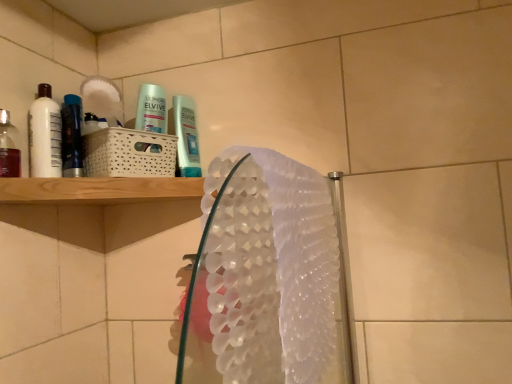
The image size is (512, 384). I want to click on metallic blue mouthwash at left, acting as the third mouthwash starting from the front, so click(x=72, y=136).

What do you see at coordinates (45, 135) in the screenshot? The width and height of the screenshot is (512, 384). I see `white glossy mouthwash at left, the second mouthwash from the front` at bounding box center [45, 135].

Where is `white glossy mouthwash at left, the second mouthwash from the back`? white glossy mouthwash at left, the second mouthwash from the back is located at coordinates (45, 135).

From the picture: Measure the distance between translucent plastic mouthwash at left, which is counted as the 1th mouthwash, starting from the front, and camera.

They are 34.76 inches apart.

You are a GUI agent. You are given a task and a screenshot of the screen. Output one action in this format:
    pyautogui.click(x=<x>, y=<y>)
    Task: Click on the translucent plastic mouthwash at left, which is counted as the 1th mouthwash, starting from the front
    
    Given the screenshot: What is the action you would take?
    pyautogui.click(x=9, y=147)

Measure the distance between white textured hand towel at center and camera.

They are 17.28 inches apart.

Find the location of a particular element. white textured hand towel at center is located at coordinates (263, 274).

The width and height of the screenshot is (512, 384). In order to click on metallic blue mouthwash at left, which is the first mouthwash from back to front in this screenshot , I will do `click(72, 136)`.

Which is nearer, (16, 175) or (63, 148)?

Point (16, 175)

From the image's perspective, is translucent plastic mouthwash at left, which appears as the third mouthwash when viewed from the back, located above metallic blue mouthwash at left, acting as the third mouthwash starting from the front?

No, from the image's perspective, translucent plastic mouthwash at left, which appears as the third mouthwash when viewed from the back, is not above metallic blue mouthwash at left, acting as the third mouthwash starting from the front.

How distant is translucent plastic mouthwash at left, which is counted as the 1th mouthwash, starting from the front, from metallic blue mouthwash at left, which is the first mouthwash from back to front?

translucent plastic mouthwash at left, which is counted as the 1th mouthwash, starting from the front, and metallic blue mouthwash at left, which is the first mouthwash from back to front, are 11.46 centimeters apart from each other.

Is white glossy mouthwash at left, the second mouthwash from the front, at the right side of metallic blue mouthwash at left, acting as the third mouthwash starting from the front?

Incorrect, white glossy mouthwash at left, the second mouthwash from the front, is not on the right side of metallic blue mouthwash at left, acting as the third mouthwash starting from the front.

Could you tell me if white glossy mouthwash at left, the second mouthwash from the front, is turned towards metallic blue mouthwash at left, acting as the third mouthwash starting from the front?

No, white glossy mouthwash at left, the second mouthwash from the front, is not facing towards metallic blue mouthwash at left, acting as the third mouthwash starting from the front.

Is there a large distance between white glossy mouthwash at left, the second mouthwash from the back, and metallic blue mouthwash at left, which is the first mouthwash from back to front?

No, white glossy mouthwash at left, the second mouthwash from the back, is not far from metallic blue mouthwash at left, which is the first mouthwash from back to front.

Is the position of white glossy mouthwash at left, the second mouthwash from the back, less distant than that of metallic blue mouthwash at left, acting as the third mouthwash starting from the front?

Yes, the depth of white glossy mouthwash at left, the second mouthwash from the back, is less than that of metallic blue mouthwash at left, acting as the third mouthwash starting from the front.

From a real-world perspective, count 2nd mouthwashs upward from the translucent plastic mouthwash at left, which is counted as the 1th mouthwash, starting from the front, and point to it. Please provide its 2D coordinates.

[(45, 135)]

Considering the positions of points (13, 127) and (37, 112), is point (13, 127) farther from camera compared to point (37, 112)?

Yes, it is.

Is translucent plastic mouthwash at left, which appears as the third mouthwash when viewed from the back, to the left or to the right of white glossy mouthwash at left, the second mouthwash from the back, in the image?

Clearly, translucent plastic mouthwash at left, which appears as the third mouthwash when viewed from the back, is on the left of white glossy mouthwash at left, the second mouthwash from the back, in the image.

From the image's perspective, between translucent plastic mouthwash at left, which appears as the third mouthwash when viewed from the back, and white glossy mouthwash at left, the second mouthwash from the back, who is located below?

From the image's view, translucent plastic mouthwash at left, which appears as the third mouthwash when viewed from the back, is below.

Is translucent plastic mouthwash at left, which appears as the third mouthwash when viewed from the back, behind white textured hand towel at center?

Yes, translucent plastic mouthwash at left, which appears as the third mouthwash when viewed from the back, is behind white textured hand towel at center.

Is translucent plastic mouthwash at left, which appears as the third mouthwash when viewed from the back, turned away from white textured hand towel at center?

No, translucent plastic mouthwash at left, which appears as the third mouthwash when viewed from the back, is not facing the opposite direction of white textured hand towel at center.

From the image's perspective, would you say translucent plastic mouthwash at left, which is counted as the 1th mouthwash, starting from the front, is shown under white textured hand towel at center?

No, from the image's perspective, translucent plastic mouthwash at left, which is counted as the 1th mouthwash, starting from the front, is not beneath white textured hand towel at center.

Can you confirm if metallic blue mouthwash at left, acting as the third mouthwash starting from the front, is thinner than white textured hand towel at center?

Correct, the width of metallic blue mouthwash at left, acting as the third mouthwash starting from the front, is less than that of white textured hand towel at center.

From the image's perspective, between metallic blue mouthwash at left, which is the first mouthwash from back to front, and white textured hand towel at center, which one is located above?

metallic blue mouthwash at left, which is the first mouthwash from back to front, from the image's perspective.

From a real-world perspective, between metallic blue mouthwash at left, which is the first mouthwash from back to front, and white textured hand towel at center, who is vertically higher?

metallic blue mouthwash at left, which is the first mouthwash from back to front.

Which of these two, metallic blue mouthwash at left, which is the first mouthwash from back to front, or white textured hand towel at center, stands taller?

white textured hand towel at center is taller.

Do you think white textured hand towel at center is within translucent plastic mouthwash at left, which is counted as the 1th mouthwash, starting from the front, or outside of it?

white textured hand towel at center exists outside the volume of translucent plastic mouthwash at left, which is counted as the 1th mouthwash, starting from the front.

Considering their positions, is white textured hand towel at center located in front of or behind translucent plastic mouthwash at left, which appears as the third mouthwash when viewed from the back?

Visually, white textured hand towel at center is located in front of translucent plastic mouthwash at left, which appears as the third mouthwash when viewed from the back.

Can you confirm if white textured hand towel at center is taller than translucent plastic mouthwash at left, which appears as the third mouthwash when viewed from the back?

Yes.

Can you confirm if white textured hand towel at center is wider than translucent plastic mouthwash at left, which appears as the third mouthwash when viewed from the back?

Indeed, white textured hand towel at center has a greater width compared to translucent plastic mouthwash at left, which appears as the third mouthwash when viewed from the back.

From the image's perspective, relative to white textured hand towel at center, is white glossy mouthwash at left, the second mouthwash from the front, above or below?

From the image's perspective, white glossy mouthwash at left, the second mouthwash from the front, appears above white textured hand towel at center.

Relative to white textured hand towel at center, is white glossy mouthwash at left, the second mouthwash from the back, in front or behind?

Visually, white glossy mouthwash at left, the second mouthwash from the back, is located behind white textured hand towel at center.

Considering the relative sizes of white glossy mouthwash at left, the second mouthwash from the front, and white textured hand towel at center in the image provided, is white glossy mouthwash at left, the second mouthwash from the front, thinner than white textured hand towel at center?

Yes, white glossy mouthwash at left, the second mouthwash from the front, is thinner than white textured hand towel at center.

Is white glossy mouthwash at left, the second mouthwash from the back, turned away from white textured hand towel at center?

white glossy mouthwash at left, the second mouthwash from the back, is not turned away from white textured hand towel at center.

Find the location of `the 1st mouthwash directly above the translucent plastic mouthwash at left, which appears as the third mouthwash when viewed from the back (from a real-world perspective)`. the 1st mouthwash directly above the translucent plastic mouthwash at left, which appears as the third mouthwash when viewed from the back (from a real-world perspective) is located at coordinates 72,136.

In the image, there is a white glossy mouthwash at left, the second mouthwash from the front. Find the location of `mouthwash above it (from the image's perspective)`. mouthwash above it (from the image's perspective) is located at coordinates (72, 136).

Which object lies nearer to the anchor point metallic blue mouthwash at left, which is the first mouthwash from back to front, white glossy mouthwash at left, the second mouthwash from the back, or translucent plastic mouthwash at left, which is counted as the 1th mouthwash, starting from the front?

white glossy mouthwash at left, the second mouthwash from the back, lies closer to metallic blue mouthwash at left, which is the first mouthwash from back to front, than the other object.

From the image, which object appears to be nearer to translucent plastic mouthwash at left, which is counted as the 1th mouthwash, starting from the front, metallic blue mouthwash at left, which is the first mouthwash from back to front, or white textured hand towel at center?

metallic blue mouthwash at left, which is the first mouthwash from back to front.

Which object lies nearer to the anchor point metallic blue mouthwash at left, which is the first mouthwash from back to front, white textured hand towel at center or translucent plastic mouthwash at left, which is counted as the 1th mouthwash, starting from the front?

translucent plastic mouthwash at left, which is counted as the 1th mouthwash, starting from the front.

When comparing their distances from white glossy mouthwash at left, the second mouthwash from the front, does translucent plastic mouthwash at left, which appears as the third mouthwash when viewed from the back, or white textured hand towel at center seem further?

Among the two, white textured hand towel at center is located further to white glossy mouthwash at left, the second mouthwash from the front.

Based on the photo, based on their spatial positions, is white textured hand towel at center or metallic blue mouthwash at left, acting as the third mouthwash starting from the front, closer to white glossy mouthwash at left, the second mouthwash from the back?

Based on the image, metallic blue mouthwash at left, acting as the third mouthwash starting from the front, appears to be nearer to white glossy mouthwash at left, the second mouthwash from the back.

From the image, which object appears to be nearer to metallic blue mouthwash at left, which is the first mouthwash from back to front, translucent plastic mouthwash at left, which is counted as the 1th mouthwash, starting from the front, or white textured hand towel at center?

translucent plastic mouthwash at left, which is counted as the 1th mouthwash, starting from the front, is positioned closer to the anchor metallic blue mouthwash at left, which is the first mouthwash from back to front.

Based on their spatial positions, is white textured hand towel at center or white glossy mouthwash at left, the second mouthwash from the back, closer to translucent plastic mouthwash at left, which is counted as the 1th mouthwash, starting from the front?

The object closer to translucent plastic mouthwash at left, which is counted as the 1th mouthwash, starting from the front, is white glossy mouthwash at left, the second mouthwash from the back.

Considering their positions, is white textured hand towel at center positioned further to white glossy mouthwash at left, the second mouthwash from the back, than translucent plastic mouthwash at left, which is counted as the 1th mouthwash, starting from the front?

white textured hand towel at center is positioned further to the anchor white glossy mouthwash at left, the second mouthwash from the back.

The image size is (512, 384). What are the coordinates of `mouthwash between translucent plastic mouthwash at left, which appears as the third mouthwash when viewed from the back, and metallic blue mouthwash at left, which is the first mouthwash from back to front, along the z-axis` in the screenshot? It's located at (45, 135).